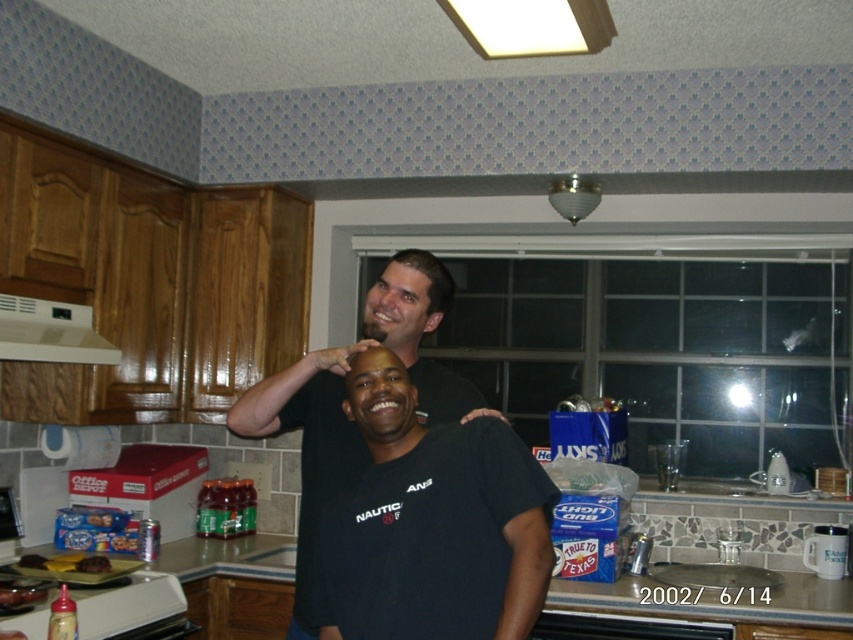
Is black matte shirt at center smaller than dark brown hair at upper center?

No.

The height and width of the screenshot is (640, 853). Describe the element at coordinates (344, 413) in the screenshot. I see `black matte shirt at center` at that location.

You are a GUI agent. You are given a task and a screenshot of the screen. Output one action in this format:
    pyautogui.click(x=<x>, y=<y>)
    Task: Click on the black matte shirt at center
    
    Given the screenshot: What is the action you would take?
    pyautogui.click(x=344, y=413)

Where is `black matte shirt at center`? black matte shirt at center is located at coordinates (344, 413).

This screenshot has width=853, height=640. Find the location of `matte black head at upper center`. matte black head at upper center is located at coordinates (405, 301).

The image size is (853, 640). What do you see at coordinates (405, 301) in the screenshot? I see `matte black head at upper center` at bounding box center [405, 301].

Describe the element at coordinates (405, 301) in the screenshot. I see `matte black head at upper center` at that location.

In order to click on matte black head at upper center in this screenshot , I will do `click(405, 301)`.

Can you confirm if black matte shirt at center is smaller than white matte exhaust hood at upper left?

Incorrect, black matte shirt at center is not smaller in size than white matte exhaust hood at upper left.

Is black matte shirt at center shorter than white matte exhaust hood at upper left?

Incorrect, black matte shirt at center's height does not fall short of white matte exhaust hood at upper left's.

Between point (259, 435) and point (35, 305), which one is positioned behind?

Positioned behind is point (35, 305).

You are a GUI agent. You are given a task and a screenshot of the screen. Output one action in this format:
    pyautogui.click(x=<x>, y=<y>)
    Task: Click on the black matte shirt at center
    The image size is (853, 640).
    Given the screenshot: What is the action you would take?
    pyautogui.click(x=344, y=413)